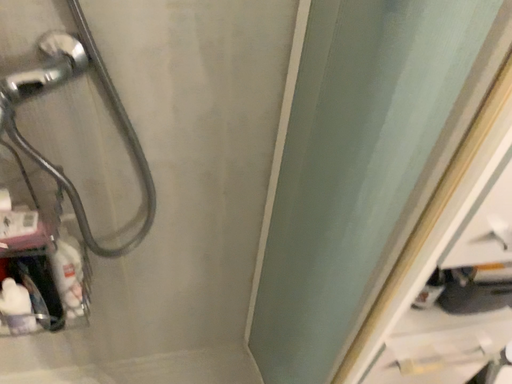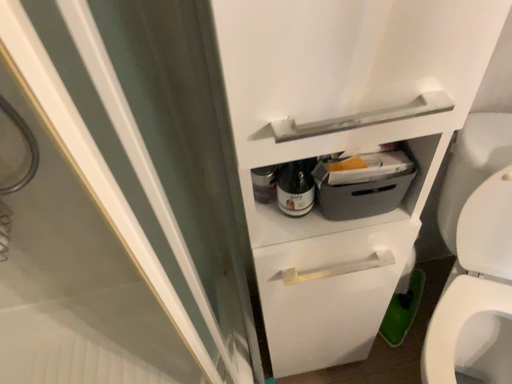
Question: Which way did the camera rotate in the video?

Choices:
 (A) rotated left
 (B) rotated right

Answer: (A)